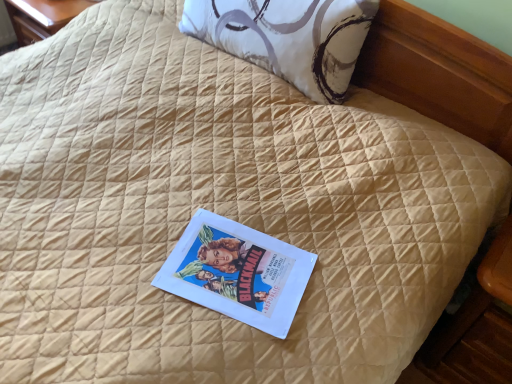
What do you see at coordinates (288, 38) in the screenshot? I see `white printed pillow at upper center` at bounding box center [288, 38].

The width and height of the screenshot is (512, 384). Find the location of `white printed pillow at upper center`. white printed pillow at upper center is located at coordinates (288, 38).

Describe the element at coordinates (238, 272) in the screenshot. I see `matte paper book at center` at that location.

At what (x,y) coordinates should I click in order to perform the action: click on matte paper book at center. Please return your answer as a coordinate pair (x, y). The width and height of the screenshot is (512, 384). Looking at the image, I should click on (238, 272).

Locate an element on the screen. Image resolution: width=512 pixels, height=384 pixels. white printed pillow at upper center is located at coordinates (288, 38).

Does white printed pillow at upper center appear on the right side of matte paper book at center?

Indeed, white printed pillow at upper center is positioned on the right side of matte paper book at center.

Considering the positions of objects white printed pillow at upper center and matte paper book at center in the image provided, who is in front, white printed pillow at upper center or matte paper book at center?

matte paper book at center.

Is point (280, 26) farther from camera compared to point (209, 246)?

Yes, point (280, 26) is behind point (209, 246).

From the image's perspective, does white printed pillow at upper center appear higher than matte paper book at center?

Yes.

From a real-world perspective, which is physically above, white printed pillow at upper center or matte paper book at center?

white printed pillow at upper center is physically above.

Can you confirm if white printed pillow at upper center is thinner than matte paper book at center?

Yes.

Between white printed pillow at upper center and matte paper book at center, which one has less height?

With less height is matte paper book at center.

Is white printed pillow at upper center bigger or smaller than matte paper book at center?

In the image, white printed pillow at upper center appears to be larger than matte paper book at center.

Is matte paper book at center surrounded by white printed pillow at upper center?

No.

Is white printed pillow at upper center far away from matte paper book at center?

No, white printed pillow at upper center is not far away from matte paper book at center.

Is white printed pillow at upper center oriented away from matte paper book at center?

No, white printed pillow at upper center is not facing the opposite direction of matte paper book at center.

What's the angular difference between white printed pillow at upper center and matte paper book at center's facing directions?

19 degrees.

Identify the location of paperback book that appears on the left of white printed pillow at upper center. (238, 272).

Which object is positioned more to the right, matte paper book at center or white printed pillow at upper center?

white printed pillow at upper center.

Which is behind, matte paper book at center or white printed pillow at upper center?

white printed pillow at upper center is further from the camera.

Is point (278, 300) farther from camera compared to point (359, 9)?

No, it is not.

From the image's perspective, which object appears higher, matte paper book at center or white printed pillow at upper center?

white printed pillow at upper center.

From a real-world perspective, relative to white printed pillow at upper center, is matte paper book at center vertically above or below?

matte paper book at center is situated lower than white printed pillow at upper center in the real world.

Considering the sizes of objects matte paper book at center and white printed pillow at upper center in the image provided, who is wider, matte paper book at center or white printed pillow at upper center?

With larger width is matte paper book at center.

Can you confirm if matte paper book at center is taller than white printed pillow at upper center?

Incorrect, the height of matte paper book at center is not larger of that of white printed pillow at upper center.

Is matte paper book at center bigger than white printed pillow at upper center?

Incorrect, matte paper book at center is not larger than white printed pillow at upper center.

Would you say matte paper book at center is inside or outside white printed pillow at upper center?

matte paper book at center cannot be found inside white printed pillow at upper center.

Is matte paper book at center beside white printed pillow at upper center?

No, matte paper book at center is not with white printed pillow at upper center.

Is matte paper book at center looking in the opposite direction of white printed pillow at upper center?

No.

The width and height of the screenshot is (512, 384). What are the coordinates of `paperback book that is under the white printed pillow at upper center (from a real-world perspective)` in the screenshot? It's located at (238, 272).

You are a GUI agent. You are given a task and a screenshot of the screen. Output one action in this format:
    pyautogui.click(x=<x>, y=<y>)
    Task: Click on the paperback book below the white printed pillow at upper center (from the image's perspective)
    This screenshot has width=512, height=384.
    Given the screenshot: What is the action you would take?
    pyautogui.click(x=238, y=272)

Where is `pillow above the matte paper book at center (from a real-world perspective)`? The height and width of the screenshot is (384, 512). pillow above the matte paper book at center (from a real-world perspective) is located at coordinates (288, 38).